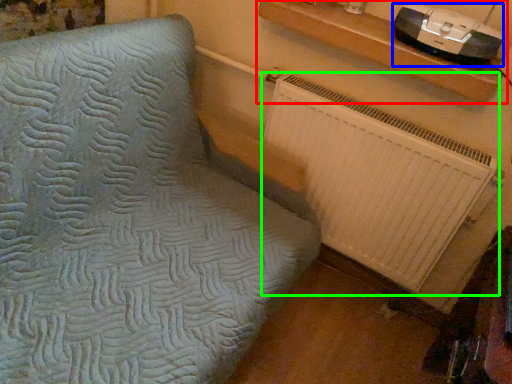
Question: Which object is positioned closest to shelf (highlighted by a red box)? Select from stereo (highlighted by a blue box) and radiator (highlighted by a green box).

Choices:
 (A) stereo
 (B) radiator

Answer: (A)